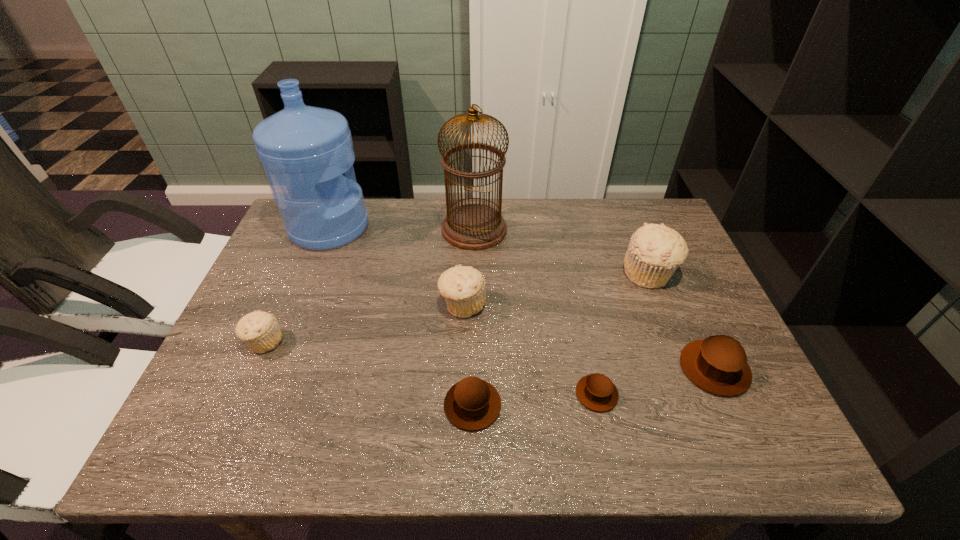
This screenshot has width=960, height=540. I want to click on blank space at the near left corner of the desktop, so click(218, 417).

Where is `vacant space at the far right corner of the desktop`? vacant space at the far right corner of the desktop is located at coordinates pos(630,221).

Find the location of `vacant area between the water jug and the leftmost beige muffin`. vacant area between the water jug and the leftmost beige muffin is located at coordinates (297, 285).

In order to click on empty space that is in between the second shortest muffin and the second beige muffin from right to left in this screenshot , I will do `click(468, 355)`.

At what (x,y) coordinates should I click in order to perform the action: click on empty space that is in between the second brown muffin from right to left and the seventh tallest object. Please return your answer as a coordinate pair (x, y). Looking at the image, I should click on (535, 400).

Where is `empty space between the smallest brown muffin and the fifth tallest muffin`? This screenshot has height=540, width=960. empty space between the smallest brown muffin and the fifth tallest muffin is located at coordinates (535, 400).

Locate an element on the screen. The image size is (960, 540). free space between the biggest brown muffin and the tallest muffin is located at coordinates (682, 321).

Find the location of a particular element. The width and height of the screenshot is (960, 540). free spot between the second smallest brown muffin and the birdcage is located at coordinates coord(473,317).

The width and height of the screenshot is (960, 540). Identify the location of vacant area between the biggest brown muffin and the leftmost beige muffin. (490, 355).

Find the location of `object that is the closest one to the third object from right to left`. object that is the closest one to the third object from right to left is located at coordinates (718, 364).